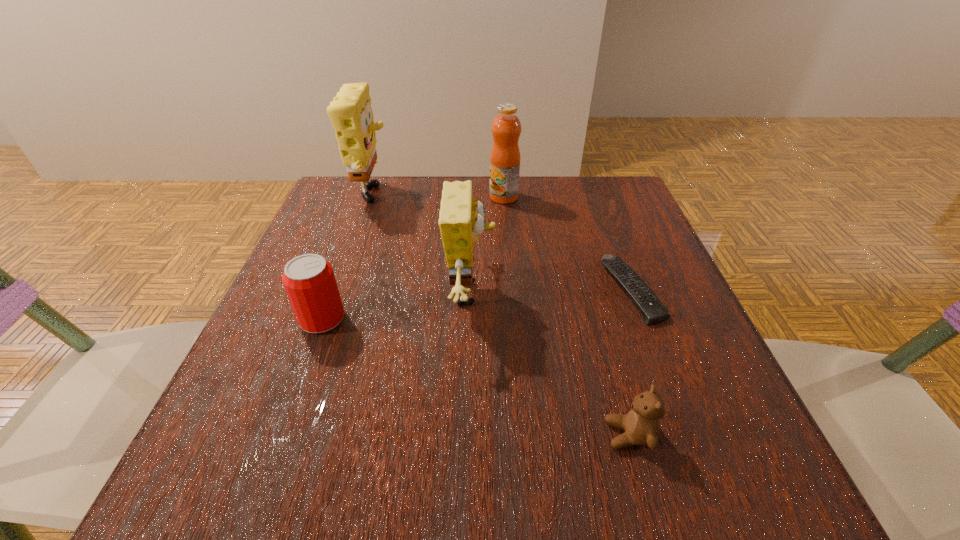
Where is `object present at the near edge`? The width and height of the screenshot is (960, 540). object present at the near edge is located at coordinates (641, 425).

The height and width of the screenshot is (540, 960). Find the location of `sponge that is positioned at the left edge`. sponge that is positioned at the left edge is located at coordinates (351, 115).

Locate an element on the screen. The width and height of the screenshot is (960, 540). beer can that is at the left edge is located at coordinates (309, 281).

You are a GUI agent. You are given a task and a screenshot of the screen. Output one action in this format:
    pyautogui.click(x=<x>, y=<y>)
    Task: Click on the teddy bear that is at the right edge
    This screenshot has width=960, height=540.
    Given the screenshot: What is the action you would take?
    pyautogui.click(x=641, y=425)

Find the location of `remote control that is at the right edge`. remote control that is at the right edge is located at coordinates (652, 310).

Image resolution: width=960 pixels, height=540 pixels. I want to click on object that is positioned at the far left corner, so click(x=351, y=115).

The image size is (960, 540). I want to click on object present at the near right corner, so click(641, 425).

In the image, there is a desktop. Find the location of `vacant space at the far edge`. vacant space at the far edge is located at coordinates (467, 177).

In the image, there is a desktop. Identify the location of vacant space at the left edge. coord(215,424).

Find the location of a particular element. vacant space at the right edge is located at coordinates (641, 249).